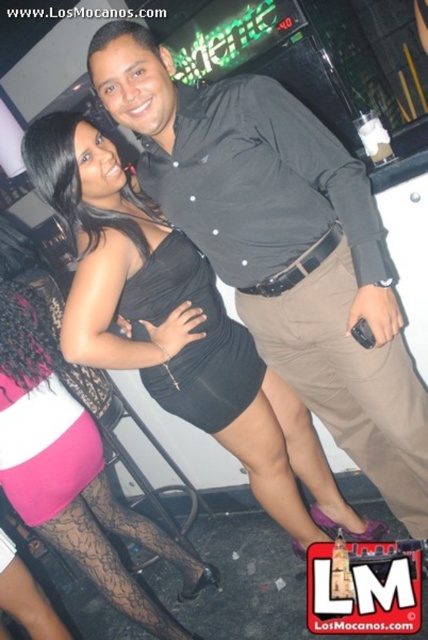
Question: Estimate the real-world distances between objects in this image. Which object is closer to the brown leather belt at center?

Choices:
 (A) black cotton shirt at center
 (B) black lace stockings at lower left

Answer: (A)

Question: Which point appears farthest from the camera in this image?

Choices:
 (A) (379, 486)
 (B) (335, 401)
 (C) (151, 259)

Answer: (A)

Question: Is black cotton shirt at center wider than brown leather belt at center?

Choices:
 (A) no
 (B) yes

Answer: (B)

Question: Which object is positioned farthest from the black lace stockings at lower left?

Choices:
 (A) brown leather belt at center
 (B) black cotton shirt at center
 (C) black satin dress at center

Answer: (A)

Question: Can you confirm if black lace stockings at lower left is positioned to the left of brown leather belt at center?

Choices:
 (A) yes
 (B) no

Answer: (A)

Question: Is black lace stockings at lower left thinner than brown leather belt at center?

Choices:
 (A) no
 (B) yes

Answer: (A)